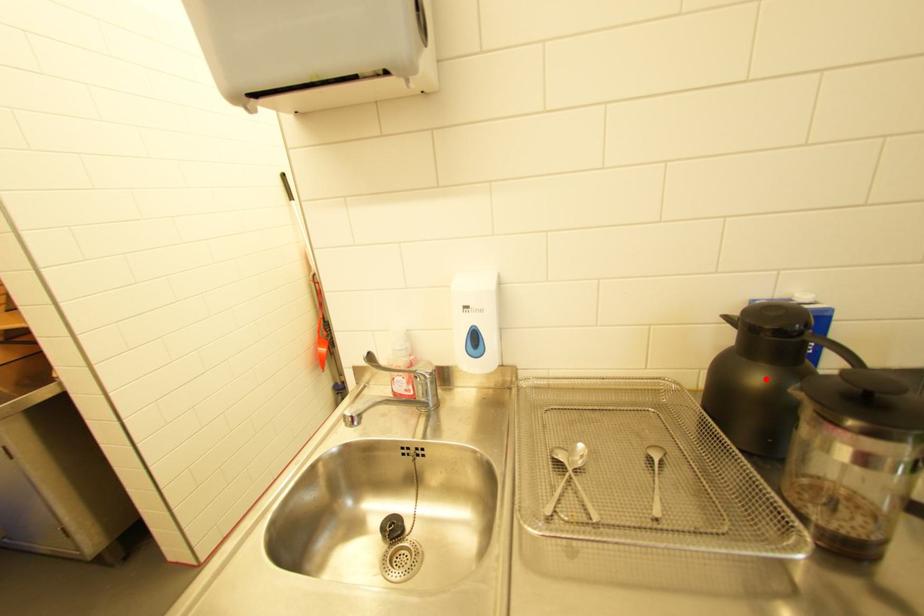
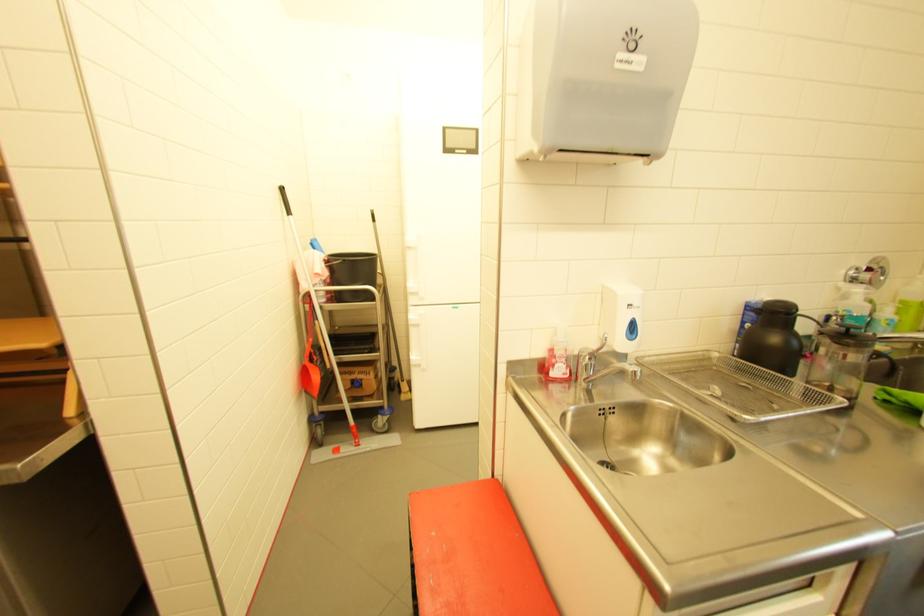
Locate, in the second image, the point that corresponds to the highlighted location in the first image.

(782, 339)